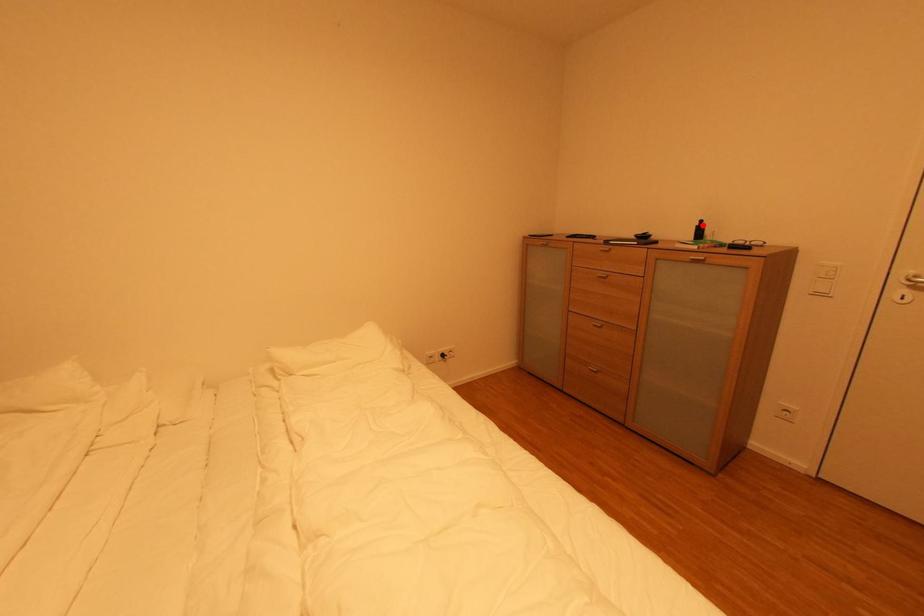
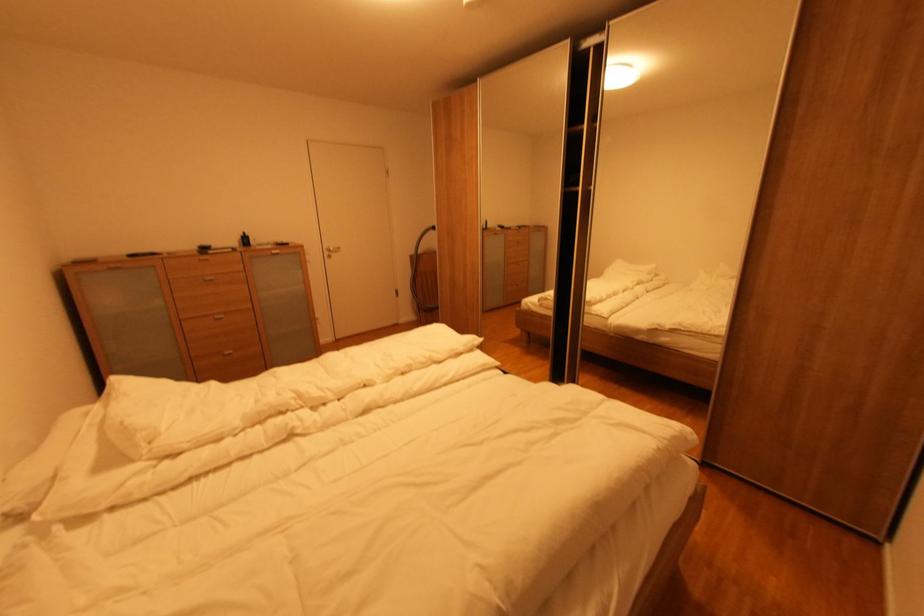
Find the pixel in the second image that matches the highlighted location in the first image.

(248, 237)